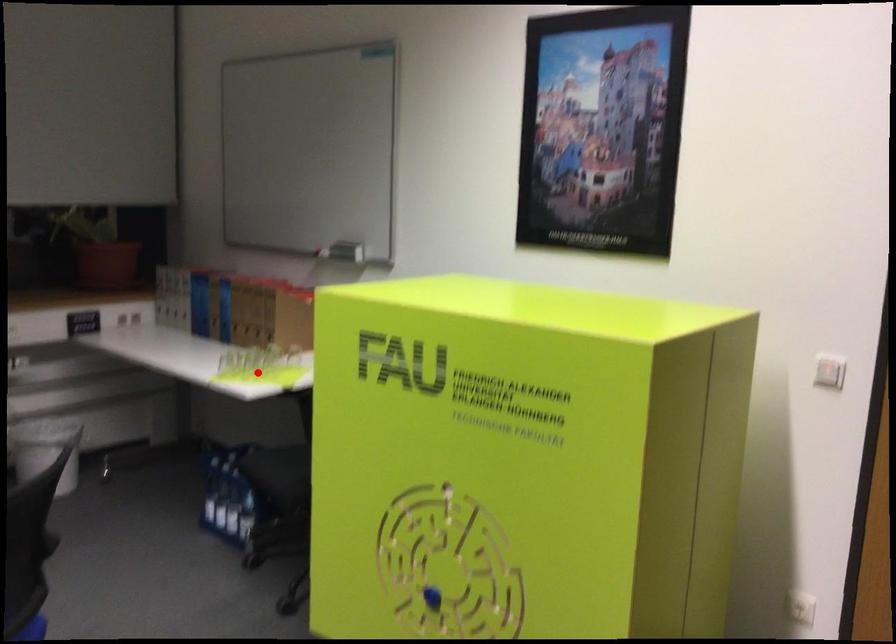
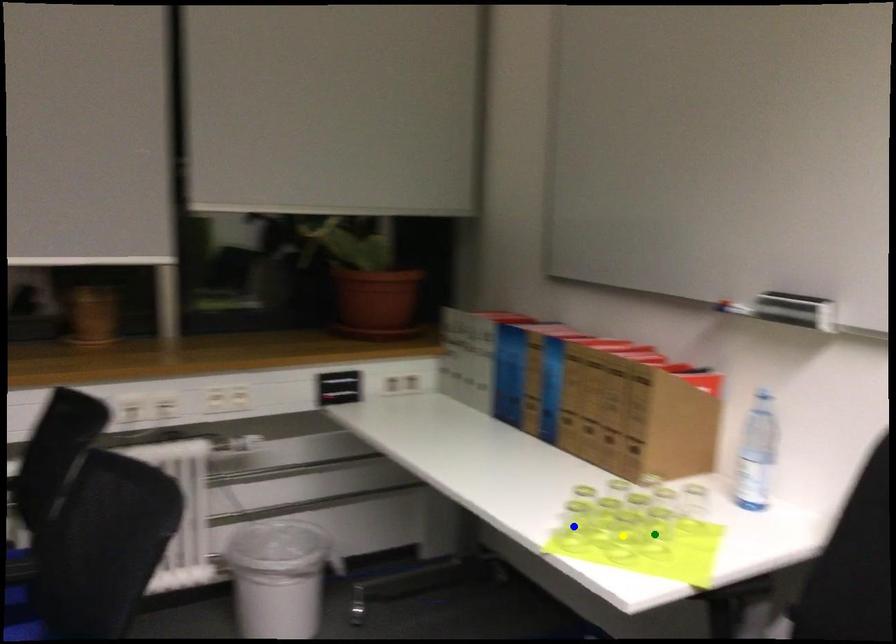
Question: I am providing you with two images of the same scene from different viewpoints. A red point is marked on the first image. You are given multiple points on the second image. Which mark in image 2 goes with the point in image 1?

Choices:
 (A) yellow point
 (B) blue point
 (C) green point

Answer: (A)